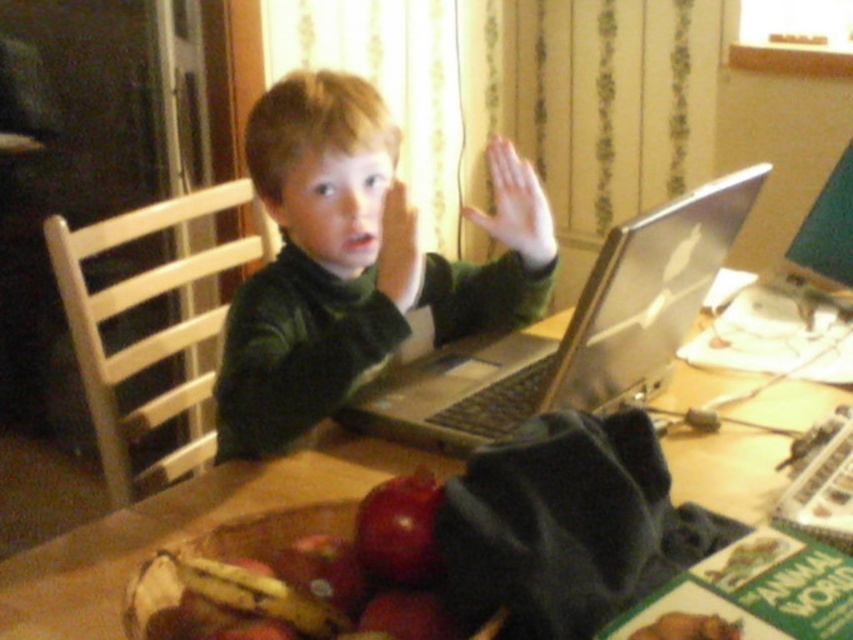
Question: Does green velvety sweater at center appear under shiny red apple at center?

Choices:
 (A) yes
 (B) no

Answer: (B)

Question: Is wooden table at center above shiny red apple at center?

Choices:
 (A) yes
 (B) no

Answer: (A)

Question: Which object is the closest to the silver metallic laptop at center?

Choices:
 (A) green velvety sweater at center
 (B) shiny red apple at center
 (C) red matte apple at lower center
 (D) wooden table at center

Answer: (A)

Question: Which object is farther from the camera taking this photo?

Choices:
 (A) silver metallic laptop at center
 (B) shiny red apple at center

Answer: (A)

Question: Does shiny red apple at center have a smaller size compared to red matte apple at lower center?

Choices:
 (A) no
 (B) yes

Answer: (A)

Question: Which of these objects is positioned farthest from the red matte apple at lower center?

Choices:
 (A) silver metallic laptop at center
 (B) wooden table at center
 (C) green velvety sweater at center

Answer: (B)